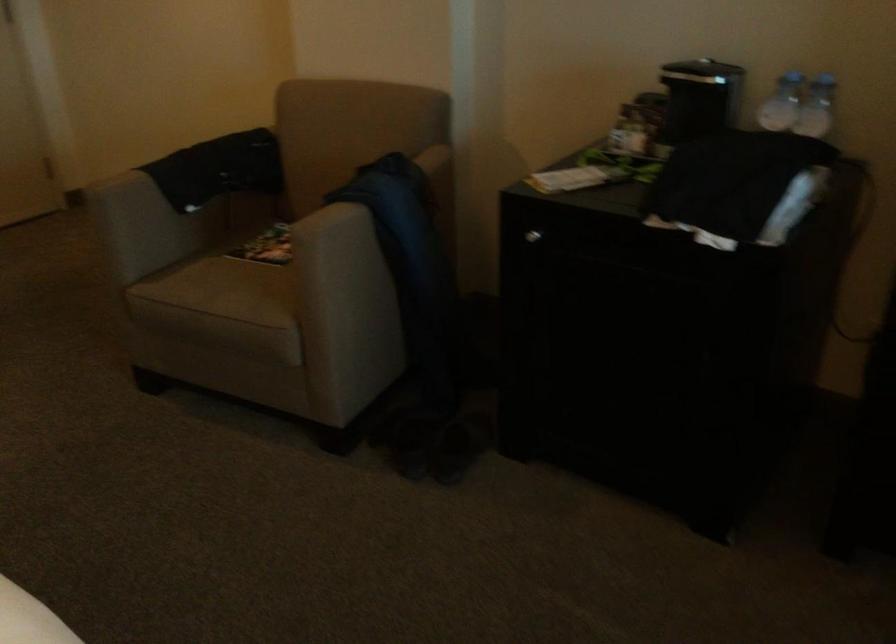
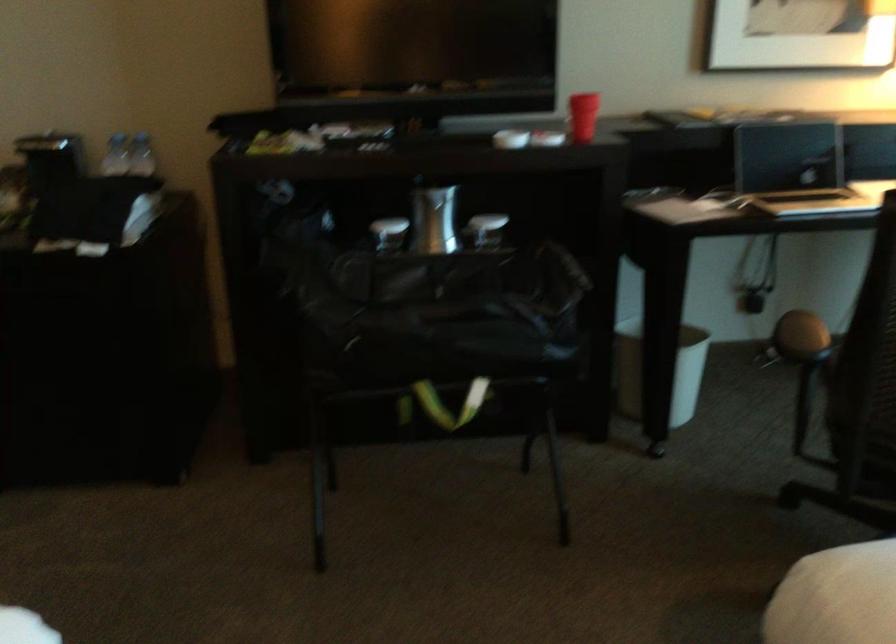
Where in the second image is the point corresponding to [776,99] from the first image?

(115, 156)